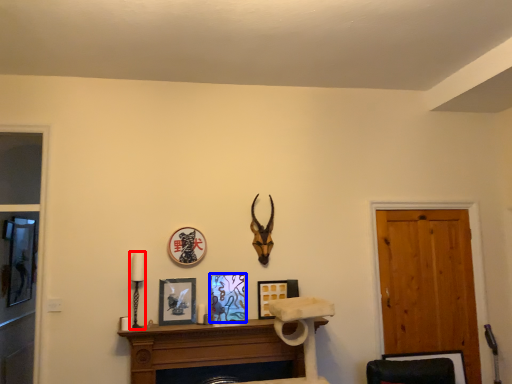
Question: Among these objects, which one is nearest to the camera, candle holder (highlighted by a red box) or picture frame (highlighted by a blue box)?

Choices:
 (A) candle holder
 (B) picture frame

Answer: (A)